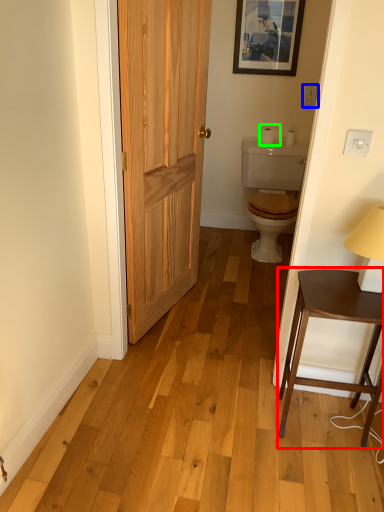
Question: Considering the real-world distances, which object is closest to table (highlighted by a red box)? electric outlet (highlighted by a blue box) or toilet paper (highlighted by a green box).

Choices:
 (A) electric outlet
 (B) toilet paper

Answer: (B)